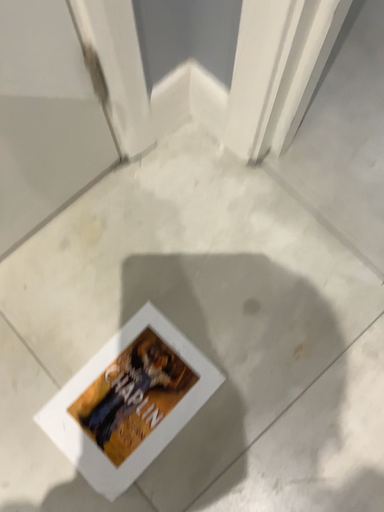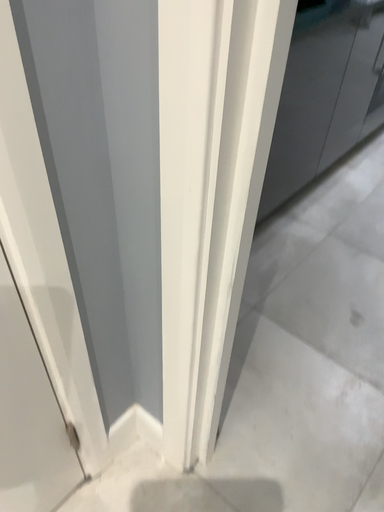
Question: How did the camera likely rotate when shooting the video?

Choices:
 (A) rotated upward
 (B) rotated downward

Answer: (A)